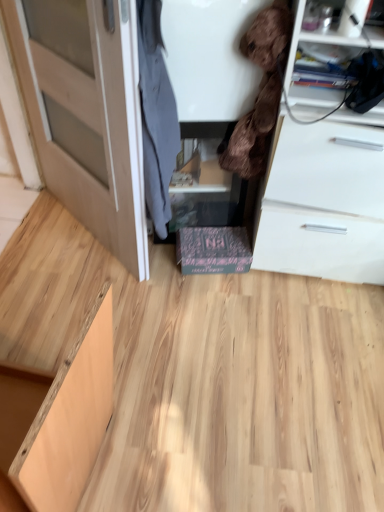
Where is `vacant region above black cardboard box at center, positioned as the second cabinetry in left-to-right order (from a real-world perspective)`? The image size is (384, 512). vacant region above black cardboard box at center, positioned as the second cabinetry in left-to-right order (from a real-world perspective) is located at coordinates (203, 243).